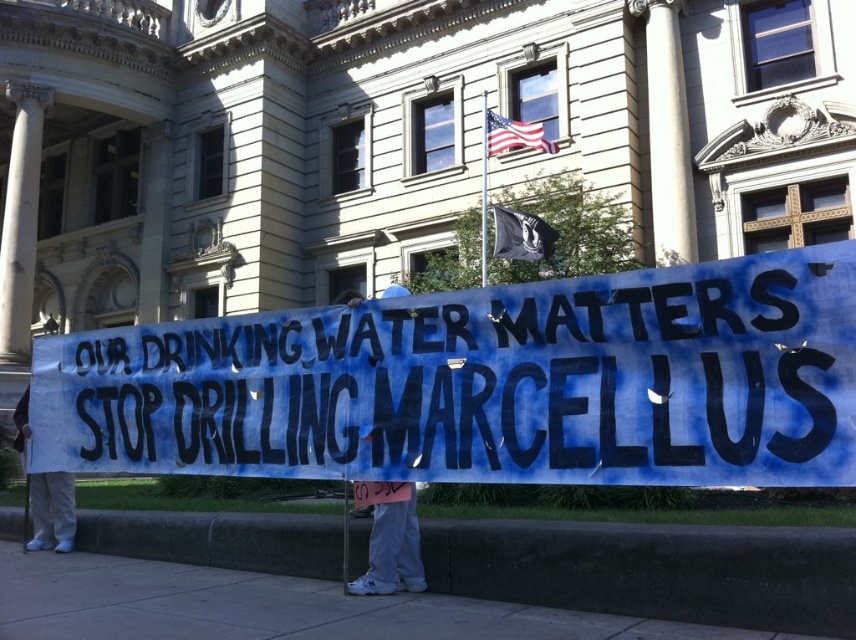
Question: Which of the following is the closest to the observer?

Choices:
 (A) (46, 518)
 (B) (28, 301)
 (C) (654, 330)

Answer: (C)

Question: From the image, what is the correct spatial relationship of blue painted sign at center in relation to white fabric sign at lower left?

Choices:
 (A) left
 (B) right

Answer: (B)

Question: Which point is closer to the camera taking this photo?

Choices:
 (A) (21, 419)
 (B) (583, 339)
 (C) (22, 173)
 (D) (681, 218)

Answer: (B)

Question: Does white stone column at center have a smaller size compared to white marble column at left?

Choices:
 (A) yes
 (B) no

Answer: (B)

Question: Is white marble column at left smaller than white fabric sign at lower left?

Choices:
 (A) no
 (B) yes

Answer: (B)

Question: Among these objects, which one is farthest from the camera?

Choices:
 (A) blue painted sign at center
 (B) white stone column at center
 (C) white marble column at left

Answer: (C)